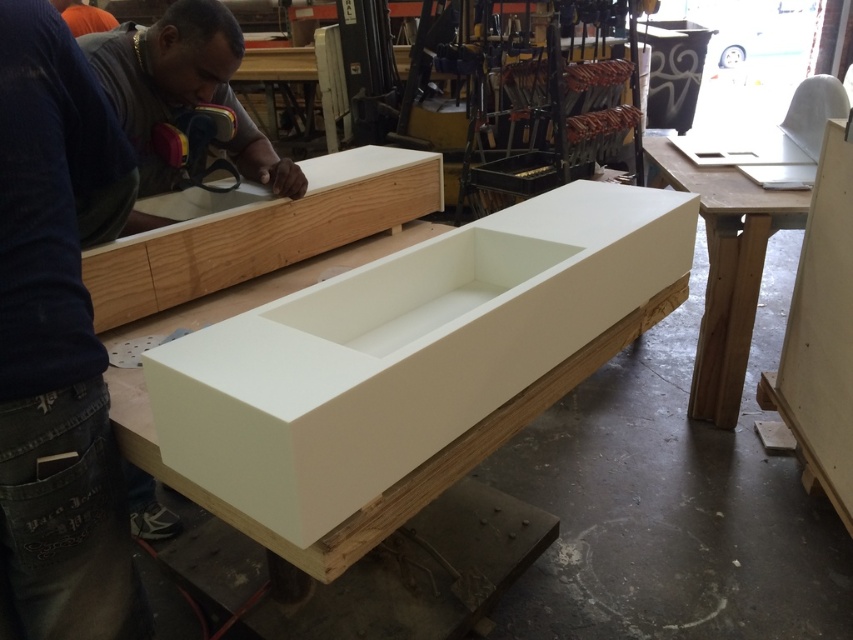
Question: Is white matte plywood at center further to the viewer compared to white matte wood workbench at center?

Choices:
 (A) yes
 (B) no

Answer: (B)

Question: Can you confirm if white matte plywood at center is smaller than natural wood plywood at center?

Choices:
 (A) no
 (B) yes

Answer: (A)

Question: Can you confirm if white matte plywood at center is smaller than white matte wood workbench at center?

Choices:
 (A) yes
 (B) no

Answer: (B)

Question: Which point is farther to the camera?

Choices:
 (A) natural wood plywood at center
 (B) white matte wood workbench at center
 (C) white matte plywood at center

Answer: (B)

Question: Estimate the real-world distances between objects in this image. Which object is closer to the natural wood plywood at center?

Choices:
 (A) white matte wood workbench at center
 (B) white matte plywood at center

Answer: (B)

Question: Estimate the real-world distances between objects in this image. Which object is farther from the white matte plywood at center?

Choices:
 (A) white matte wood workbench at center
 (B) natural wood plywood at center

Answer: (A)